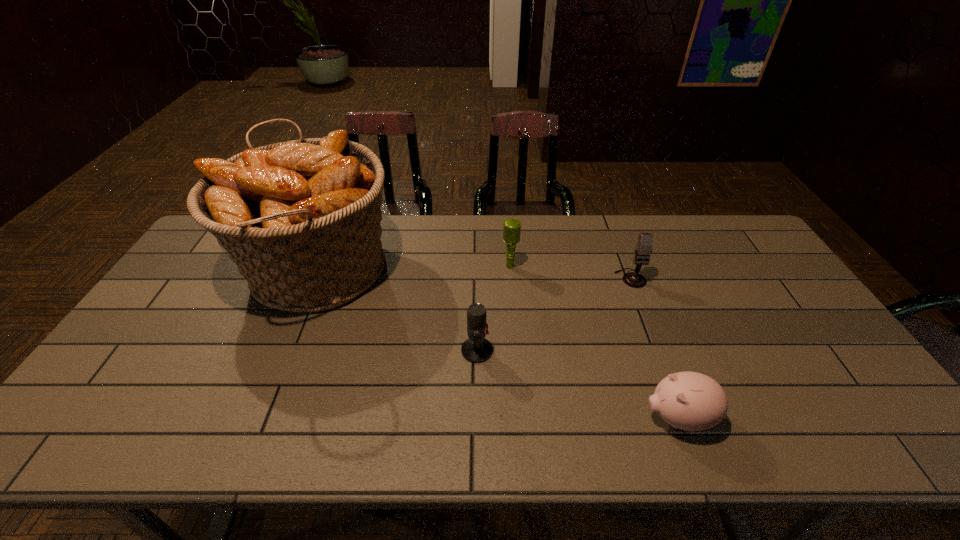
In the image, there is a desktop. Identify the location of vacant space at the right edge. This screenshot has height=540, width=960. (760, 267).

Where is `free space at the far right corner of the desktop`? This screenshot has width=960, height=540. free space at the far right corner of the desktop is located at coordinates (722, 244).

In the image, there is a desktop. Where is `free space at the near right corner`? free space at the near right corner is located at coordinates (828, 419).

Locate an element on the screen. free spot between the second microphone from right to left and the tallest object is located at coordinates (414, 269).

This screenshot has height=540, width=960. Identify the location of unoccupied position between the fourth object from right to left and the piggy bank. (578, 384).

This screenshot has width=960, height=540. I want to click on vacant space that's between the second microphone from left to right and the shortest object, so click(x=594, y=342).

Locate an element on the screen. The image size is (960, 540). free space between the nearest object and the second nearest object is located at coordinates (578, 384).

Locate an element on the screen. Image resolution: width=960 pixels, height=540 pixels. free space that is in between the shortest object and the rightmost microphone is located at coordinates (655, 348).

The width and height of the screenshot is (960, 540). Identify the location of free space between the second microphone from left to right and the rightmost microphone. (570, 272).

In order to click on vacant space that's between the rightmost microphone and the fourth object from right to left in this screenshot , I will do `click(554, 314)`.